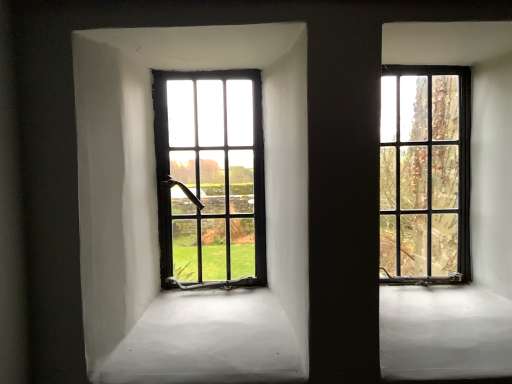
Question: Is matte black window at right, the 2th window viewed from the left, in front of or behind matte black window at center left, which is counted as the second window, starting from the right, in the image?

Choices:
 (A) front
 (B) behind

Answer: (A)

Question: Does point (425, 122) appear closer or farther from the camera than point (247, 114)?

Choices:
 (A) closer
 (B) farther

Answer: (B)

Question: In the image, is matte black window at right, the 1th window positioned from the right, on the left side or the right side of matte black window at center left, which is counted as the second window, starting from the right?

Choices:
 (A) right
 (B) left

Answer: (A)

Question: From their relative heights in the image, would you say matte black window at center left, the first window when ordered from left to right, is taller or shorter than matte black window at right, the 2th window viewed from the left?

Choices:
 (A) tall
 (B) short

Answer: (B)

Question: From the image's perspective, relative to matte black window at right, the 2th window viewed from the left, is matte black window at center left, which is counted as the second window, starting from the right, above or below?

Choices:
 (A) below
 (B) above

Answer: (A)

Question: Visually, is matte black window at center left, which is counted as the second window, starting from the right, positioned to the left or to the right of matte black window at right, the 2th window viewed from the left?

Choices:
 (A) left
 (B) right

Answer: (A)

Question: Is matte black window at center left, which is counted as the second window, starting from the right, situated inside matte black window at right, the 1th window positioned from the right, or outside?

Choices:
 (A) outside
 (B) inside

Answer: (A)